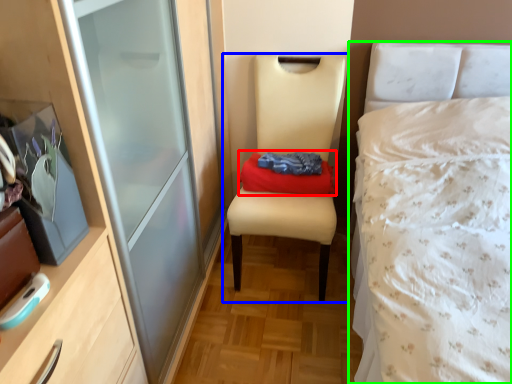
Question: Which is farther away from clothing (highlighted by a red box)? chair (highlighted by a blue box) or bed (highlighted by a green box)?

Choices:
 (A) chair
 (B) bed

Answer: (B)